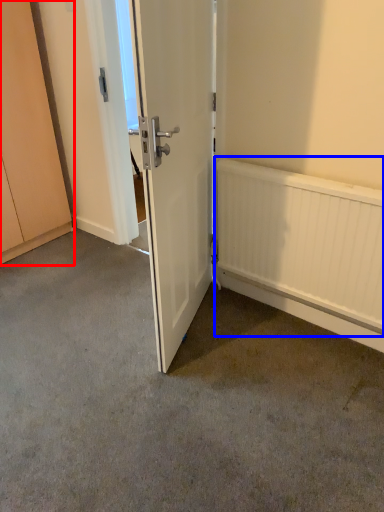
Question: Which point is closer to the camera, cabinetry (highlighted by a red box) or radiator (highlighted by a blue box)?

Choices:
 (A) cabinetry
 (B) radiator

Answer: (B)